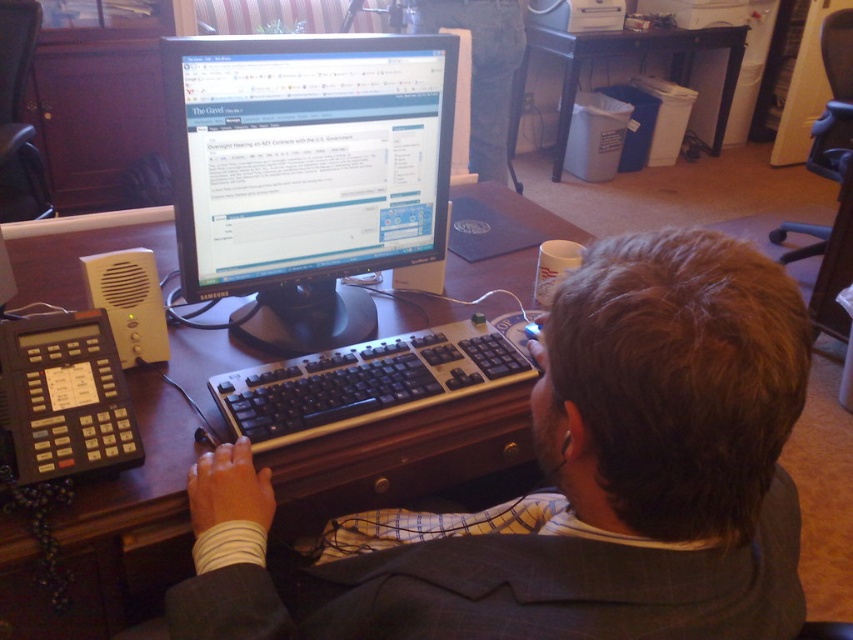
Question: Estimate the real-world distances between objects in this image. Which object is farther from the black glossy monitor at center?

Choices:
 (A) wooden at center
 (B) white plastic trash can at lower right

Answer: (B)

Question: Is black glossy monitor at center wider than wooden at center?

Choices:
 (A) no
 (B) yes

Answer: (A)

Question: Can you confirm if black glossy monitor at center is positioned to the left of black plastic keyboard at center?

Choices:
 (A) no
 (B) yes

Answer: (B)

Question: Based on their relative distances, which object is nearer to the white plastic trash can at lower right?

Choices:
 (A) wooden at center
 (B) black plastic keyboard at center

Answer: (A)

Question: Which of the following is the closest to the observer?

Choices:
 (A) (312, 426)
 (B) (198, 451)
 (C) (569, 106)

Answer: (B)

Question: Is black glossy monitor at center further to camera compared to wooden at center?

Choices:
 (A) no
 (B) yes

Answer: (B)